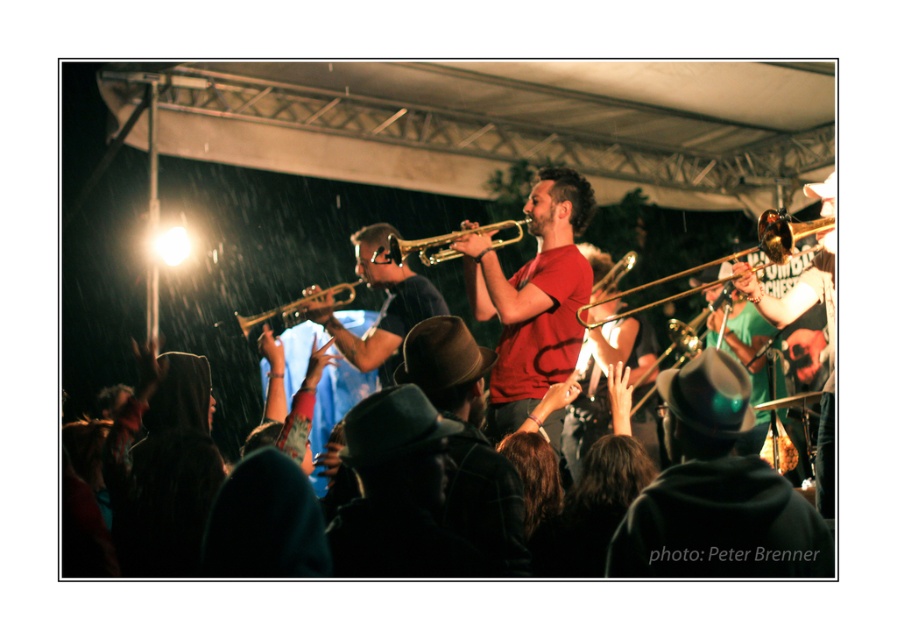
Is point (800, 522) behind point (619, 260)?

No, (800, 522) is closer to viewer.

Locate an element on the screen. The height and width of the screenshot is (640, 897). black matte hat at center is located at coordinates (716, 493).

The height and width of the screenshot is (640, 897). What do you see at coordinates (716, 493) in the screenshot? I see `black matte hat at center` at bounding box center [716, 493].

Locate an element on the screen. black matte hat at center is located at coordinates 716,493.

Does matte red shirt at center have a lesser height compared to gold brass trumpet at center?

Incorrect, matte red shirt at center's height does not fall short of gold brass trumpet at center's.

In the scene shown: Which is below, matte red shirt at center or gold brass trumpet at center?

matte red shirt at center

Does point (541, 179) come in front of point (612, 276)?

Yes, point (541, 179) is closer to viewer.

Identify the location of matte red shirt at center. The image size is (897, 640). (532, 298).

Describe the element at coordinates (443, 243) in the screenshot. Image resolution: width=897 pixels, height=640 pixels. I see `gold shiny trumpet at center` at that location.

Does gold shiny trumpet at center have a greater height compared to shiny brass trumpet at center?

No.

Which is in front, point (463, 230) or point (251, 324)?

Positioned in front is point (463, 230).

The height and width of the screenshot is (640, 897). Identify the location of gold shiny trumpet at center. (443, 243).